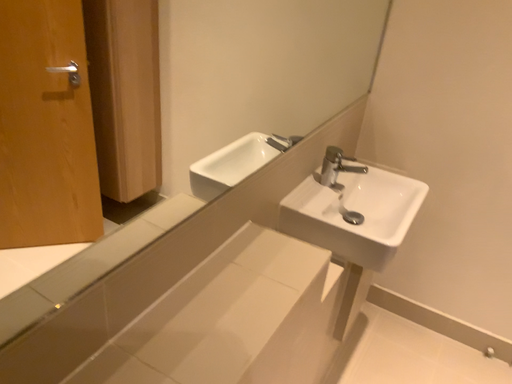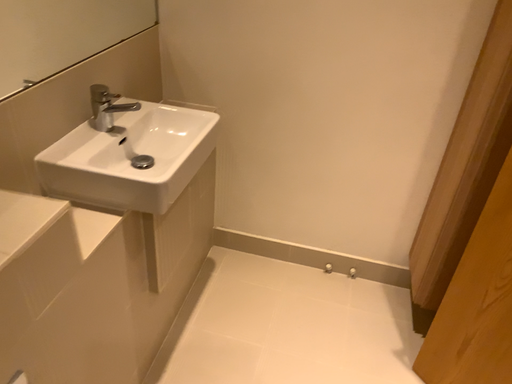
Question: Which way did the camera rotate in the video?

Choices:
 (A) rotated left
 (B) rotated right

Answer: (B)